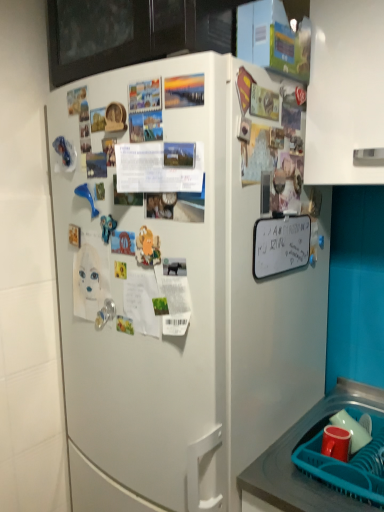
Question: From a real-world perspective, is matte red cup at lower right above or below white matte dry erase board at upper right, the first poster viewed from the back?

Choices:
 (A) above
 (B) below

Answer: (B)

Question: From their relative heights in the image, would you say matte red cup at lower right is taller or shorter than white matte dry erase board at upper right, the first poster viewed from the back?

Choices:
 (A) short
 (B) tall

Answer: (A)

Question: Considering the real-world distances, which object is closest to the smooth plastic tray at lower right?

Choices:
 (A) matte paper poster at upper center, marked as the first poster in a top-to-bottom arrangement
 (B) white matte refrigerator at center
 (C) teal plastic basket at lower right
 (D) matte red cup at lower right
 (E) white paper at center, marked as the third poster in a back-to-front arrangement

Answer: (C)

Question: Which of these objects is positioned closest to the teal plastic basket at lower right?

Choices:
 (A) white matte dry erase board at upper right, which is counted as the 1th poster, starting from the right
 (B) white paper at center, marked as the third poster in a back-to-front arrangement
 (C) matte paper poster at upper center, which ranks as the 3th poster in bottom-to-top order
 (D) matte red cup at lower right
 (E) smooth plastic tray at lower right

Answer: (E)